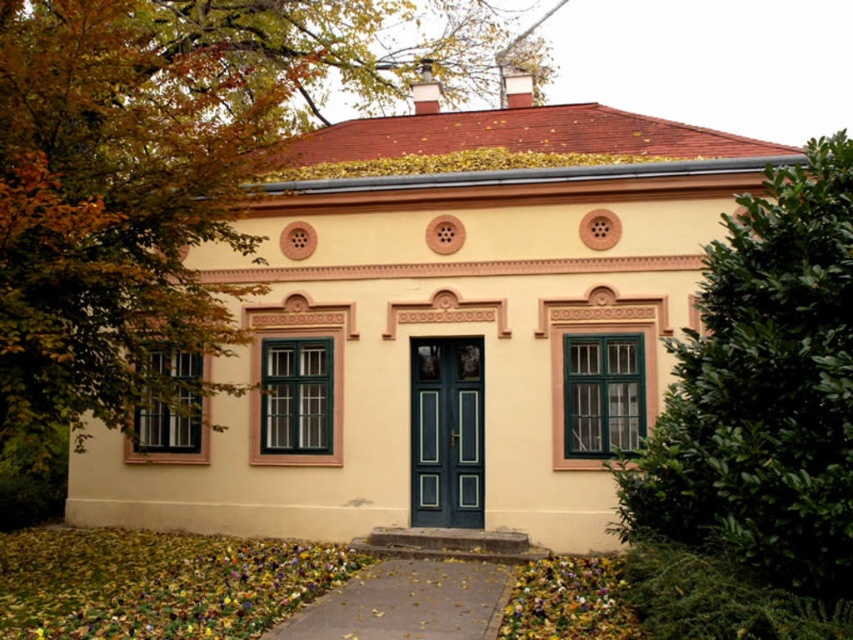
Question: Considering the real-world distances, which object is farthest from the green leafy bush at right?

Choices:
 (A) teal glossy door at center
 (B) green leafy tree at left

Answer: (B)

Question: Does green leafy bush at right have a lesser width compared to teal glossy door at center?

Choices:
 (A) no
 (B) yes

Answer: (A)

Question: Which point is farther to the camera?

Choices:
 (A) green leafy tree at left
 (B) green leafy bush at right
 (C) teal glossy door at center

Answer: (C)

Question: Based on their relative distances, which object is nearer to the teal glossy door at center?

Choices:
 (A) green leafy bush at right
 (B) green leafy tree at left

Answer: (A)

Question: From the image, what is the correct spatial relationship of green leafy tree at left in relation to teal glossy door at center?

Choices:
 (A) left
 (B) right

Answer: (A)

Question: Is green leafy tree at left in front of teal glossy door at center?

Choices:
 (A) no
 (B) yes

Answer: (B)